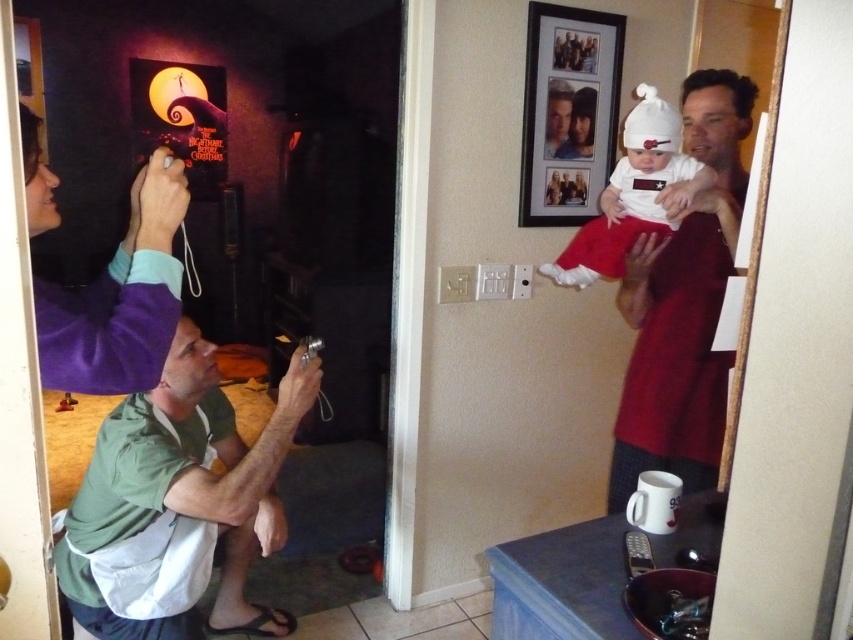
Question: Does green fabric shirt at lower left appear over white cotton baby at upper right?

Choices:
 (A) no
 (B) yes

Answer: (A)

Question: Which object is closer to the camera taking this photo?

Choices:
 (A) matte red shirt at right
 (B) green fabric shirt at lower left
 (C) wooden framed photo at upper center

Answer: (B)

Question: Is matte red shirt at right to the left of wooden framed photo at upper center from the viewer's perspective?

Choices:
 (A) yes
 (B) no

Answer: (B)

Question: Which point is farther from the camera taking this photo?

Choices:
 (A) (654, 371)
 (B) (531, 58)

Answer: (B)

Question: Is green fabric shirt at lower left smaller than white cotton baby at upper right?

Choices:
 (A) no
 (B) yes

Answer: (A)

Question: Which is farther from the white cotton baby at upper right?

Choices:
 (A) green fabric shirt at lower left
 (B) matte red shirt at right

Answer: (A)